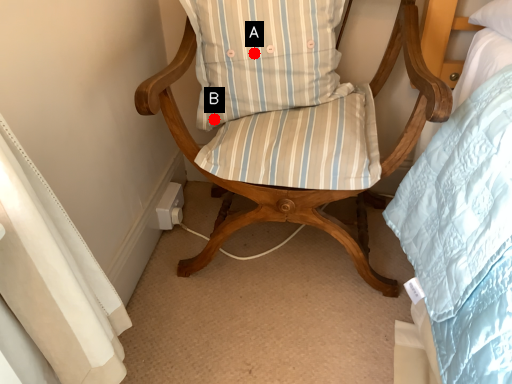
Question: Two points are circled on the image, labeled by A and B beside each circle. Among these points, which one is nearest to the camera?

Choices:
 (A) A is closer
 (B) B is closer

Answer: (A)